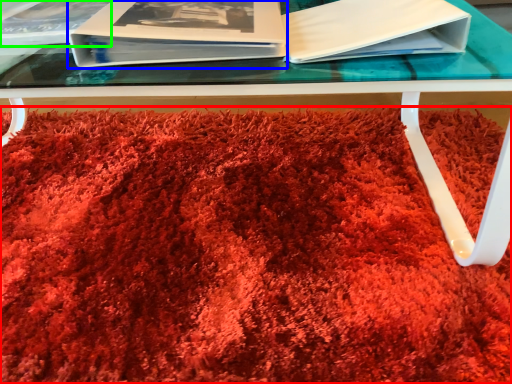
Question: Considering the real-world distances, which object is farthest from blanket (highlighted by a red box)? paperback book (highlighted by a blue box) or album (highlighted by a green box)?

Choices:
 (A) paperback book
 (B) album

Answer: (B)